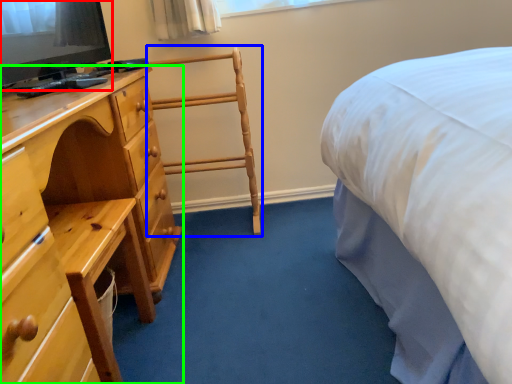
Question: Which object is the closest to the television (highlighted by a red box)? Choose among these: chair (highlighted by a blue box) or chest of drawers (highlighted by a green box).

Choices:
 (A) chair
 (B) chest of drawers

Answer: (B)